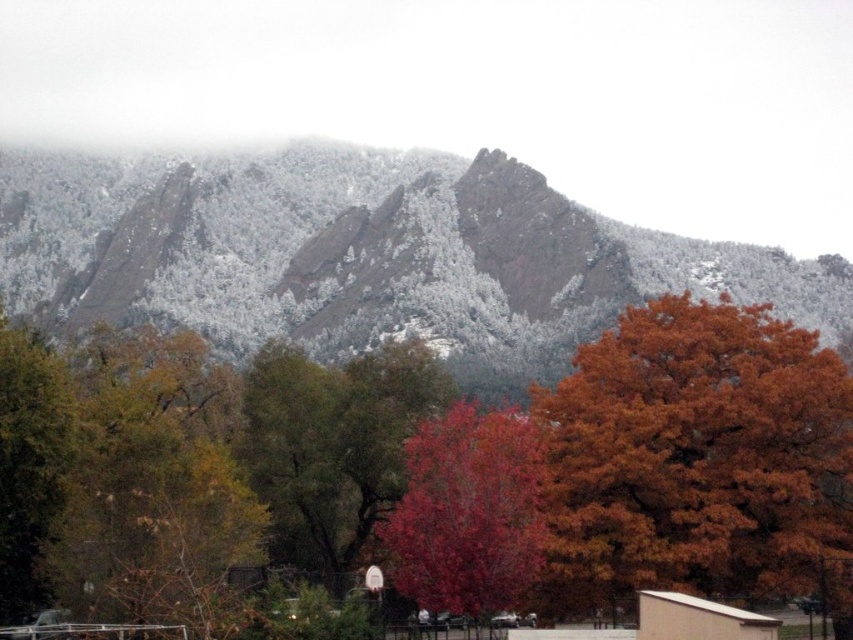
Question: Can you confirm if orange matte tree at center is positioned to the left of orange leafy tree at center right?

Choices:
 (A) no
 (B) yes

Answer: (B)

Question: Based on their relative distances, which object is nearer to the shiny red tree at center?

Choices:
 (A) orange leafy tree at center right
 (B) snow-covered rock at upper center

Answer: (A)

Question: Which object is positioned farthest from the orange leafy tree at center right?

Choices:
 (A) orange matte tree at center
 (B) shiny red tree at center
 (C) snow-covered rock at upper center

Answer: (C)

Question: Is orange matte tree at center above orange leafy tree at center right?

Choices:
 (A) yes
 (B) no

Answer: (A)

Question: Can you confirm if orange matte tree at center is positioned to the right of shiny red tree at center?

Choices:
 (A) no
 (B) yes

Answer: (A)

Question: Which of the following is the farthest from the observer?

Choices:
 (A) shiny red tree at center
 (B) orange leafy tree at center right

Answer: (B)